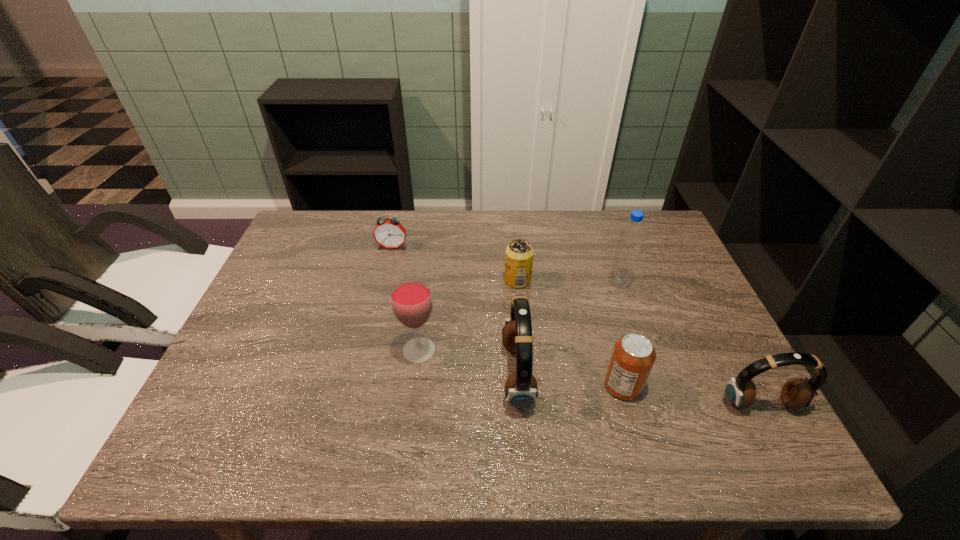
This screenshot has height=540, width=960. I want to click on the taller headset, so click(x=521, y=390).

Identify the location of the fourth shortest object. The image size is (960, 540). (796, 393).

Find the location of a particular element. The width and height of the screenshot is (960, 540). the right headset is located at coordinates tap(796, 393).

Where is `beer can`? beer can is located at coordinates (519, 255).

The width and height of the screenshot is (960, 540). I want to click on water bottle, so click(x=631, y=237).

You are a GUI agent. You are given a task and a screenshot of the screen. Output one action in this format:
    pyautogui.click(x=<x>, y=<y>)
    Task: Click on the farthest object
    This screenshot has width=960, height=540.
    Given the screenshot: What is the action you would take?
    pyautogui.click(x=389, y=233)

Where is `alarm clock`? Image resolution: width=960 pixels, height=540 pixels. alarm clock is located at coordinates (389, 233).

At what (x,y) coordinates should I click in order to perform the action: click on can. Please return your answer as a coordinate pair (x, y). The width and height of the screenshot is (960, 540). Looking at the image, I should click on (633, 356).

In order to click on wineglass in this screenshot , I will do 411,298.

The height and width of the screenshot is (540, 960). What are the coordinates of `vacant space situated 0.170m on the ear cup of the taller headset` in the screenshot? It's located at (608, 375).